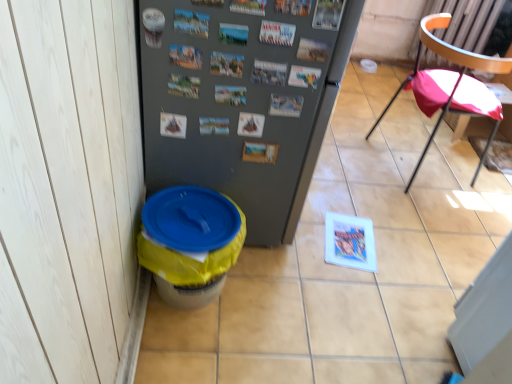
Identify the location of free space in front of yellow plastic potty at lower left. (187, 357).